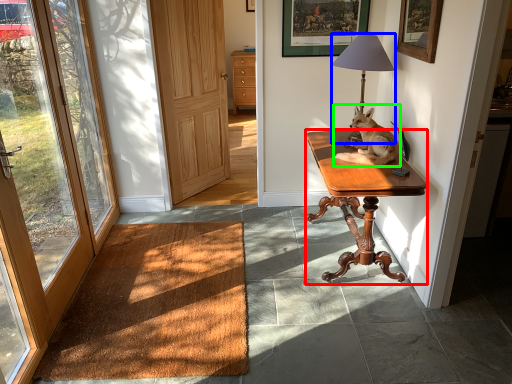
Question: Which object is the farthest from desk (highlighted by a red box)? Choose among these: lamp (highlighted by a blue box) or dog (highlighted by a green box).

Choices:
 (A) lamp
 (B) dog

Answer: (A)